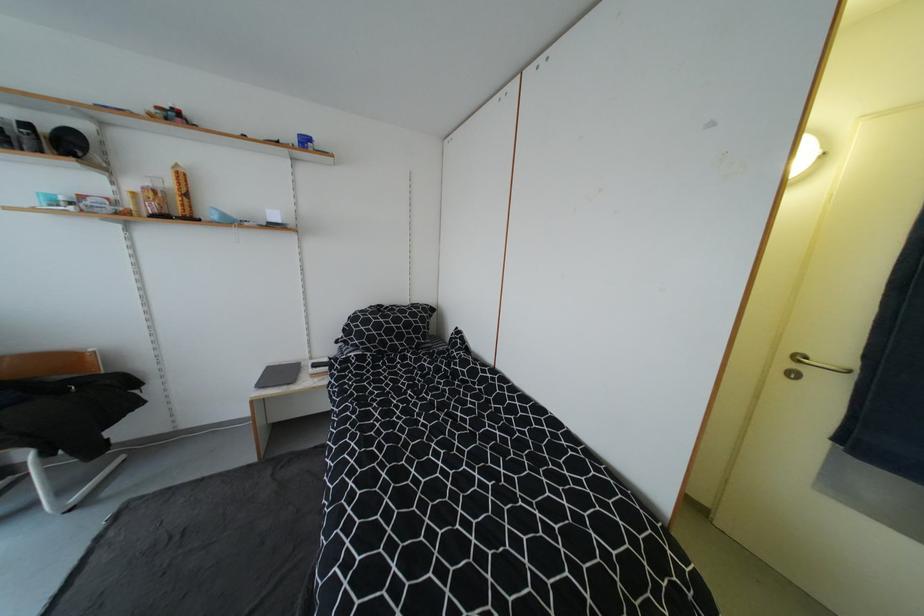
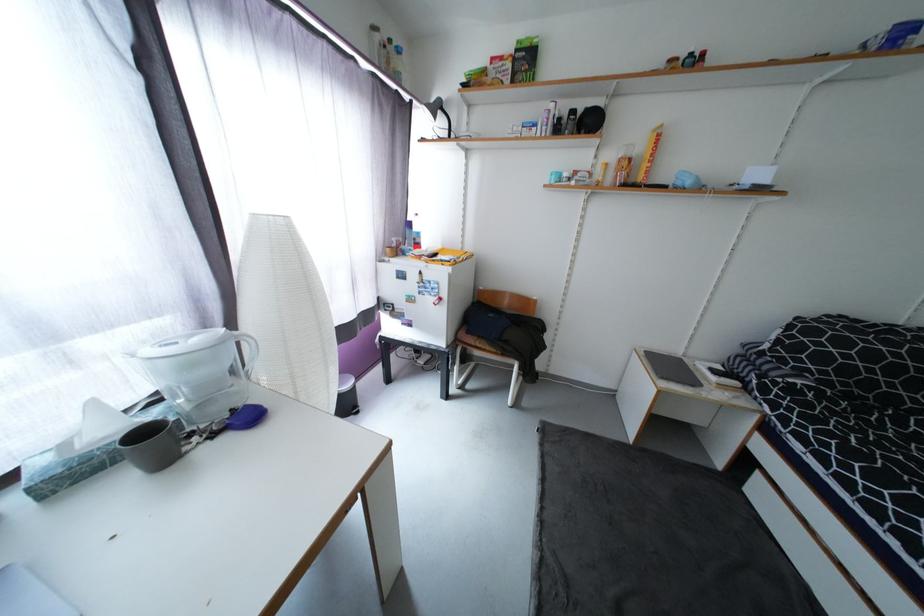
In the second image, find the point that corresponds to point 176,185 in the first image.

(647, 151)